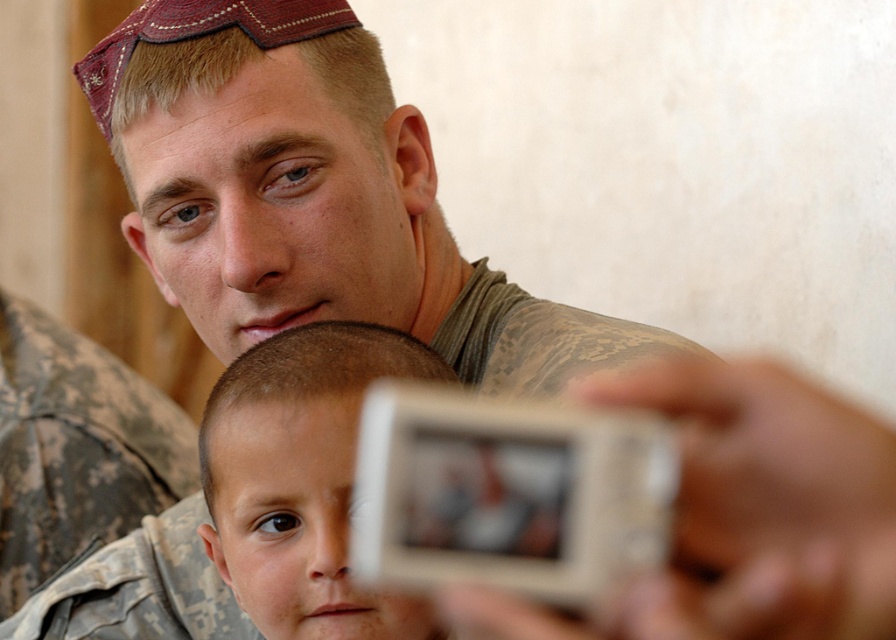
Question: Does smooth skin boy at center come in front of camouflage fabric uniform at upper center?

Choices:
 (A) no
 (B) yes

Answer: (B)

Question: Does smooth skin boy at center have a greater width compared to camouflage fabric uniform at upper center?

Choices:
 (A) yes
 (B) no

Answer: (B)

Question: Is smooth skin boy at center positioned in front of camouflage fabric uniform at upper center?

Choices:
 (A) no
 (B) yes

Answer: (B)

Question: Which object is closer to the camera taking this photo?

Choices:
 (A) smooth skin boy at center
 (B) camouflage fabric uniform at upper center

Answer: (A)